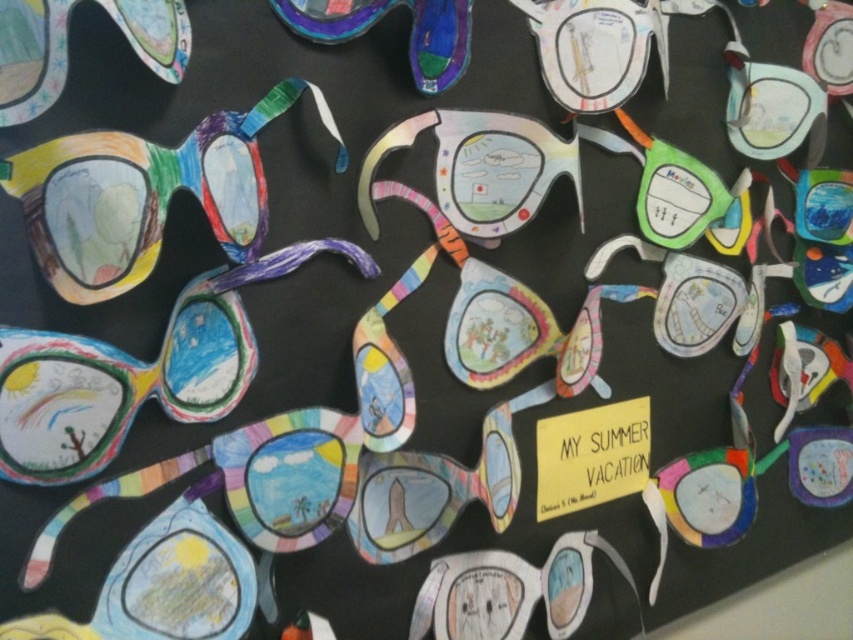
You are an artist arranging sunglasses on a dark background. You have two matte paper goggles at center and matte paper goggles at upper left. Which one is positioned to the right side of the other?

The matte paper goggles at center is positioned to the right of the matte paper goggles at upper left.

From the picture: You are an artist trying to hang two matte goggles on a wall. The matte multicolored goggles at left and the matte blue goggles at upper center need to be arranged so that one is visible in front of the other. Which goggles should you place in front to match the original image?

To match the original image, you should place the matte multicolored goggles at left in front of the matte blue goggles at upper center because the matte multicolored goggles at left is in front of matte blue goggles at upper center.